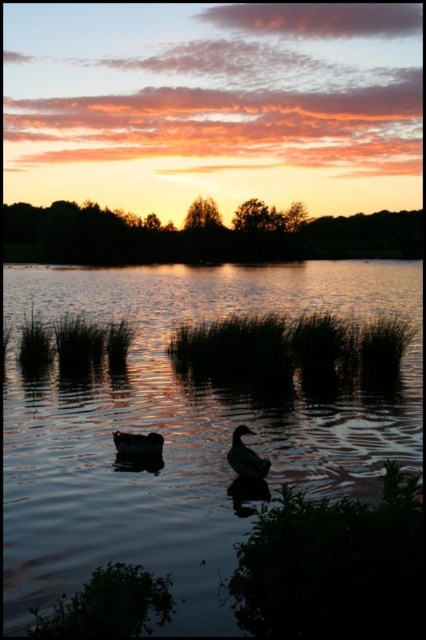
Who is positioned more to the right, green grass at center or silvery glossy duck at center?

green grass at center

Is green grass at center further to the viewer compared to silvery glossy duck at center?

Yes, it is behind silvery glossy duck at center.

Does point (204, 365) come farther from viewer compared to point (238, 461)?

Yes, point (204, 365) is behind point (238, 461).

The height and width of the screenshot is (640, 426). I want to click on green grass at center, so click(290, 342).

Locate an element on the screen. This screenshot has width=426, height=640. smooth water at center is located at coordinates (181, 428).

Between smooth water at center and dark matte duck at center, which one has less height?

Standing shorter between the two is dark matte duck at center.

Between point (419, 312) and point (160, 456), which one is positioned behind?

Point (419, 312)

I want to click on smooth water at center, so click(181, 428).

Can you confirm if smooth water at center is wider than silvery glossy duck at center?

Correct, the width of smooth water at center exceeds that of silvery glossy duck at center.

In the scene shown: Does smooth water at center appear over silvery glossy duck at center?

Yes, smooth water at center is above silvery glossy duck at center.

Does point (198, 518) lie behind point (261, 458)?

That is False.

Identify the location of smooth water at center. The width and height of the screenshot is (426, 640). (181, 428).